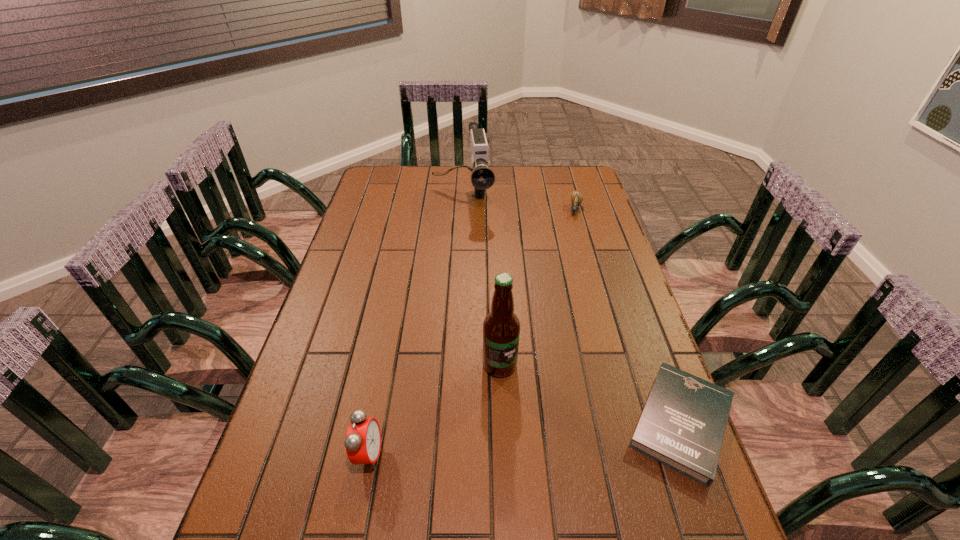
The image size is (960, 540). What are the coordinates of `free space on the desktop that is between the alarm clock and the shortest object and is positioned on the recording direction of the camcorder` in the screenshot? It's located at (492, 442).

The image size is (960, 540). What are the coordinates of `free space on the desktop that is between the alarm clock and the book and is positioned on the label of the beer bottle` in the screenshot? It's located at (534, 437).

At what (x,y) coordinates should I click in order to perform the action: click on vacant space on the desktop that is between the leftmost object and the shortest object and is positioned on the front-facing side of the escargot. Please return your answer as a coordinate pair (x, y). The width and height of the screenshot is (960, 540). Looking at the image, I should click on (527, 438).